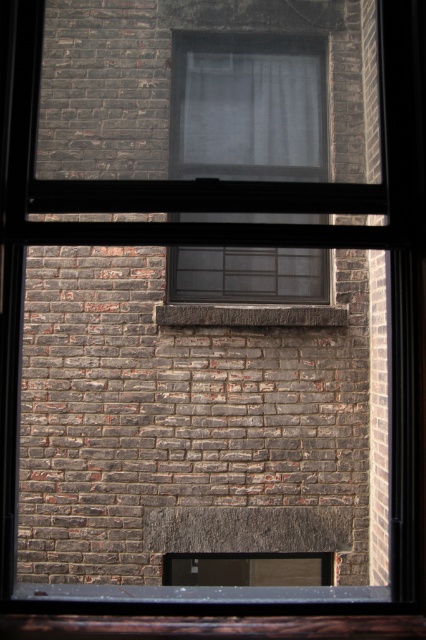
Between clear glass window at center and brown stone window sill at center, which one appears on the right side from the viewer's perspective?

brown stone window sill at center

Who is more distant from viewer, (x=313, y=259) or (x=290, y=324)?

The point (x=313, y=259) is more distant.

Measure the distance between clear glass window at center and camera.

clear glass window at center is 17.20 feet away from camera.

This screenshot has height=640, width=426. Find the location of `clear glass window at center`. clear glass window at center is located at coordinates (247, 108).

Which of these two, white sheer curtain at center or brown stone window sill at center, stands shorter?

Standing shorter between the two is brown stone window sill at center.

Is point (233, 104) positioned after point (256, 310)?

Yes, point (233, 104) is behind point (256, 310).

Locate an element on the screen. white sheer curtain at center is located at coordinates (250, 108).

Who is shorter, clear glass window at center or white sheer curtain at center?

With less height is white sheer curtain at center.

Can you confirm if clear glass window at center is smaller than white sheer curtain at center?

Incorrect, clear glass window at center is not smaller in size than white sheer curtain at center.

The image size is (426, 640). What do you see at coordinates (247, 108) in the screenshot? I see `clear glass window at center` at bounding box center [247, 108].

You are a GUI agent. You are given a task and a screenshot of the screen. Output one action in this format:
    pyautogui.click(x=<x>, y=<y>)
    Task: Click on the clear glass window at center
    This screenshot has height=640, width=426.
    Given the screenshot: What is the action you would take?
    pyautogui.click(x=247, y=108)